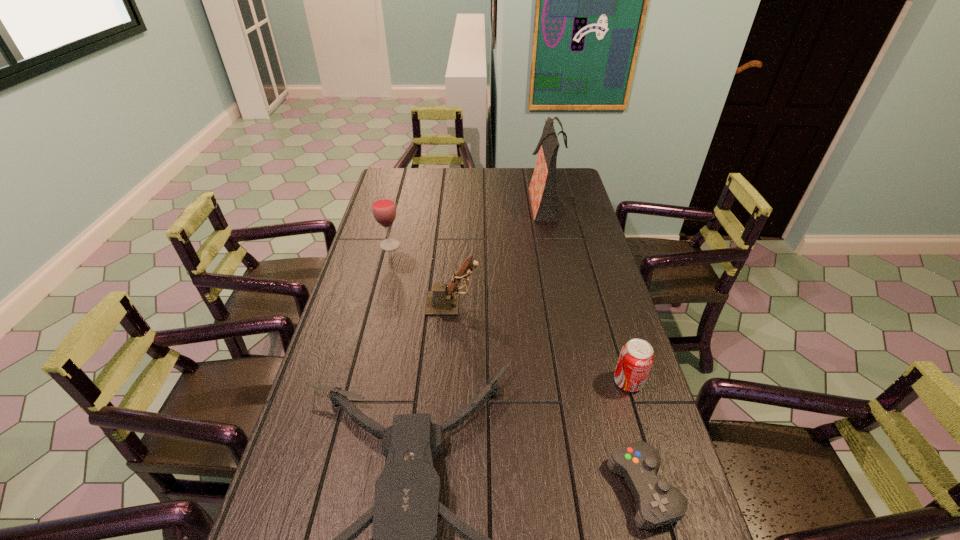
In the image, there is a desktop. At what (x,y) coordinates should I click in order to perform the action: click on vacant space at the left edge. Please return your answer as a coordinate pair (x, y). The height and width of the screenshot is (540, 960). Looking at the image, I should click on (357, 274).

I want to click on vacant position at the right edge of the desktop, so click(619, 445).

In the image, there is a desktop. Identify the location of free space at the far left corner. (416, 172).

Find the location of a particular element. This screenshot has width=960, height=540. vacant space that is in between the shortest object and the soda is located at coordinates (636, 435).

This screenshot has width=960, height=540. Identify the location of vacant area that lies between the figurine and the third shortest object. (540, 343).

Locate an element on the screen. free spot between the shortest object and the third farthest object is located at coordinates (548, 396).

In order to click on vacant area that lies between the shopping bag and the third shortest object in this screenshot , I will do pyautogui.click(x=586, y=292).

Identify the location of free space that is in between the soda and the second farthest object. (509, 313).

At what (x,y) coordinates should I click in order to perform the action: click on vacant region between the soda and the control. Please return your answer as a coordinate pair (x, y). This screenshot has width=960, height=540. Looking at the image, I should click on (636, 435).

At what (x,y) coordinates should I click in order to perform the action: click on unoccupied area between the third farthest object and the third shortest object. Please return your answer as a coordinate pair (x, y). This screenshot has height=540, width=960. Looking at the image, I should click on (540, 343).